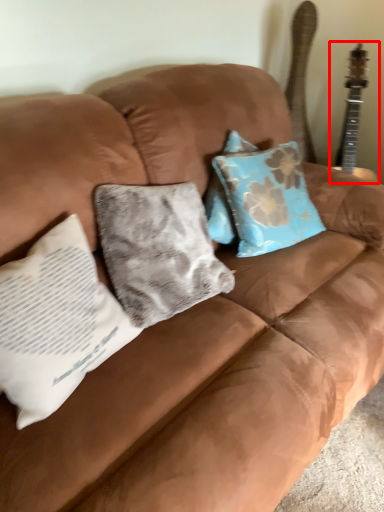
Question: Considering the relative positions of guitar (annotated by the red box) and pillow in the image provided, where is guitar (annotated by the red box) located with respect to the staircase?

Choices:
 (A) left
 (B) right

Answer: (B)